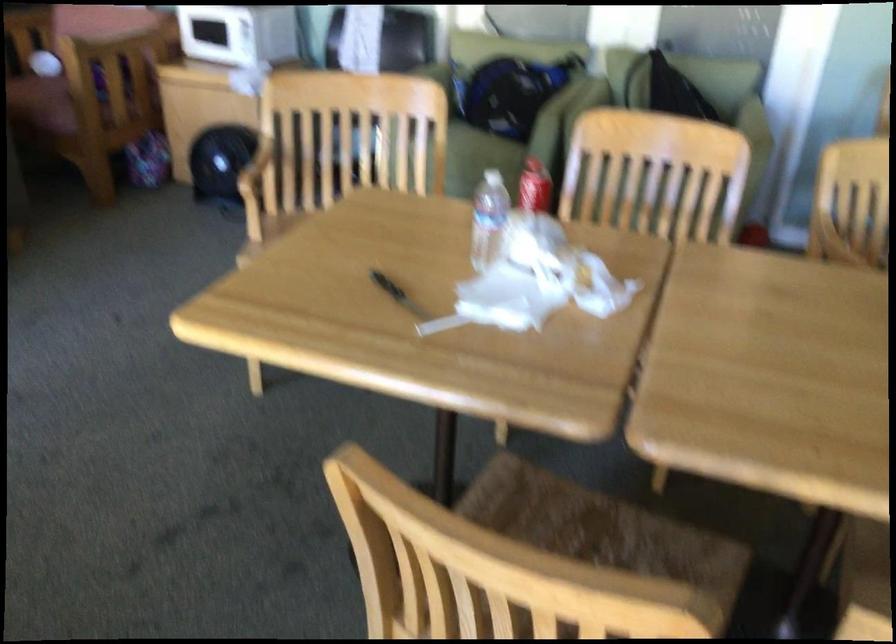
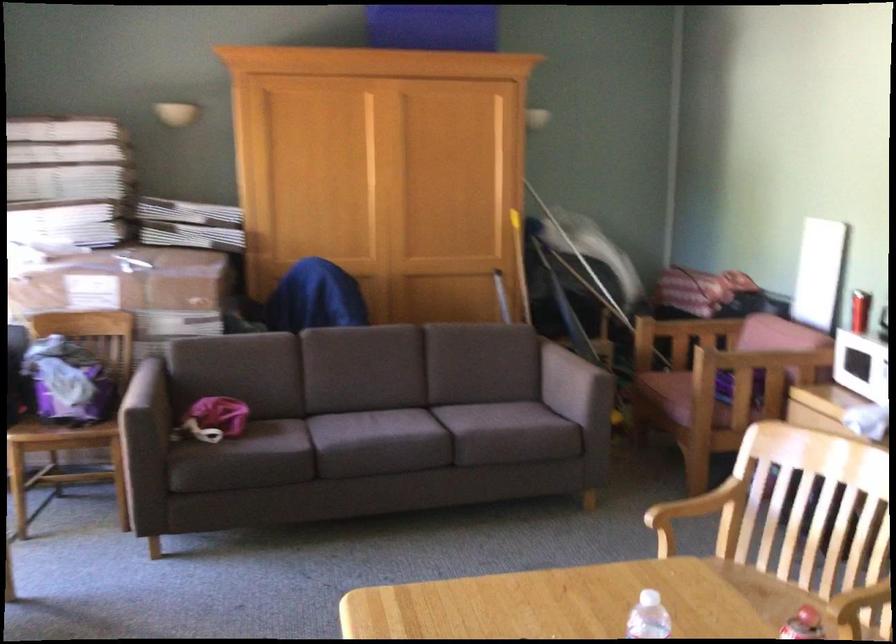
Question: How did the camera likely rotate?

Choices:
 (A) Left
 (B) Right
 (C) Up
 (D) Down

Answer: (A)